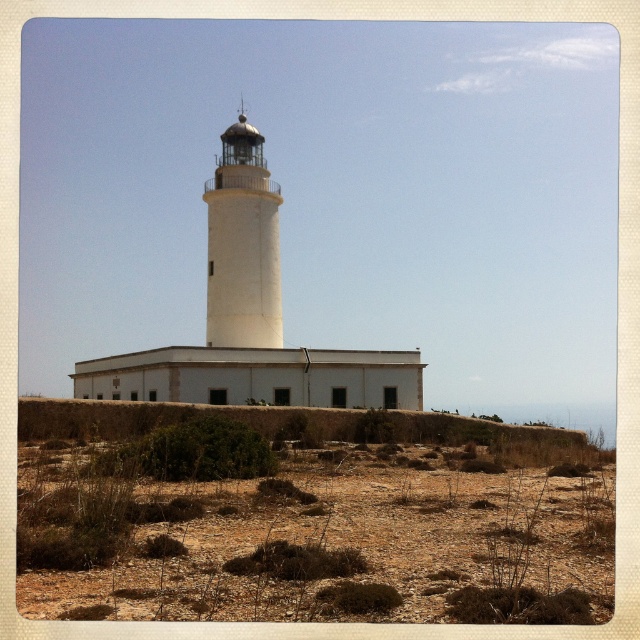
Does brown gravelly dirt field at lower center appear over white smooth tower at center?

No, brown gravelly dirt field at lower center is not above white smooth tower at center.

Does brown gravelly dirt field at lower center appear under white smooth tower at center?

Correct, brown gravelly dirt field at lower center is located below white smooth tower at center.

Locate an element on the screen. The image size is (640, 640). brown gravelly dirt field at lower center is located at coordinates (316, 541).